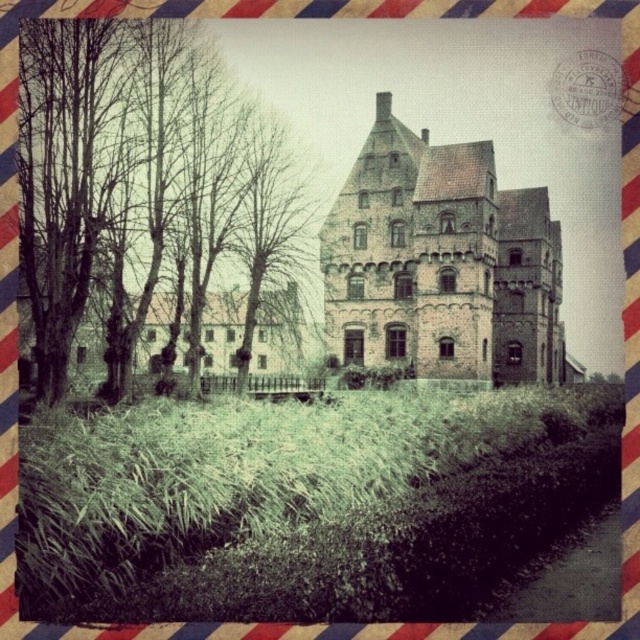
Is bare branches at left to the left of brown stone castle at center from the viewer's perspective?

Correct, you'll find bare branches at left to the left of brown stone castle at center.

Does bare branches at left appear under brown stone castle at center?

No.

Does point (308, 268) come closer to viewer compared to point (342, 204)?

Yes, point (308, 268) is in front of point (342, 204).

The image size is (640, 640). Find the location of `bare branches at left`. bare branches at left is located at coordinates [x=180, y=202].